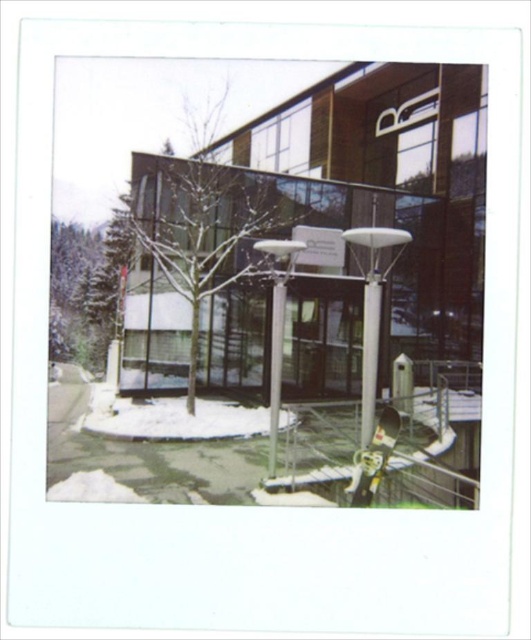
Question: From the image, what is the correct spatial relationship of green textured tree at left in relation to silver metallic lamp post at center?

Choices:
 (A) above
 (B) below

Answer: (A)

Question: Which of the following is the farthest from the observer?

Choices:
 (A) green textured tree at left
 (B) silver metallic lamp post at center

Answer: (A)

Question: Which point appears farthest from the camera in this image?

Choices:
 (A) (73, 358)
 (B) (273, 440)

Answer: (A)

Question: Is green textured tree at left behind silver metallic lamp post at center?

Choices:
 (A) yes
 (B) no

Answer: (A)

Question: Does green textured tree at left lie behind silver metallic lamp post at center?

Choices:
 (A) no
 (B) yes

Answer: (B)